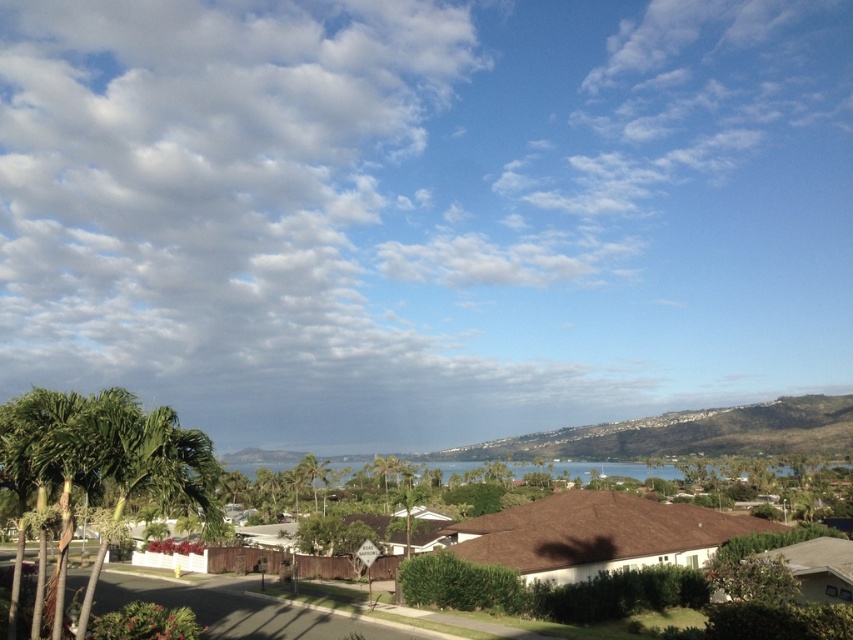
You are a bird flying over the suburban landscape. You see the white fluffy cloud at upper center and the green leafy palm tree at center. Which object is closer to you?

The white fluffy cloud at upper center is closer to you because it is in front of the green leafy palm tree at center.

You are an observer looking at the suburban landscape. You notice the white fluffy cloud at upper center and the green leafy palm tree at lower left. Which object appears closer to you in the scene?

The white fluffy cloud at upper center appears closer to you because it is in front of the green leafy palm tree at lower left.

You are standing in the suburban landscape and want to take a photo of the white fluffy cloud at upper center and the green leafy palm tree at center. Which object is located to the right of the other?

The white fluffy cloud at upper center is positioned on the right side of green leafy palm tree at center.